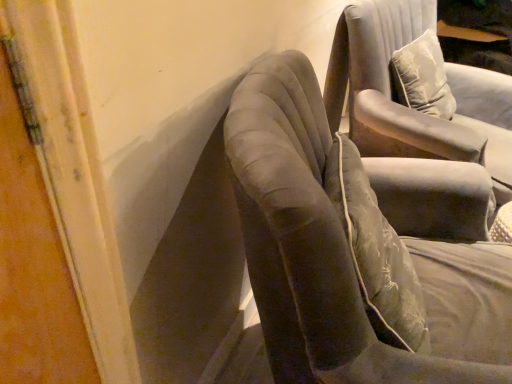
Question: Is velvet gray chair at center, which is counted as the second chair, starting from the back, surrounding suede-like gray chair at upper right, which is counted as the 2th chair, starting from the front?

Choices:
 (A) no
 (B) yes

Answer: (A)

Question: From a real-world perspective, is velvet gray chair at center, positioned as the first chair in front-to-back order, physically above suede-like gray chair at upper right, which is counted as the 2th chair, starting from the front?

Choices:
 (A) yes
 (B) no

Answer: (B)

Question: Are velvet gray chair at center, which is counted as the second chair, starting from the back, and suede-like gray chair at upper right, placed as the first chair when sorted from back to front, far apart?

Choices:
 (A) no
 (B) yes

Answer: (A)

Question: Is velvet gray chair at center, positioned as the first chair in front-to-back order, not within suede-like gray chair at upper right, placed as the first chair when sorted from back to front?

Choices:
 (A) yes
 (B) no

Answer: (A)

Question: Does velvet gray chair at center, which is counted as the second chair, starting from the back, lie behind suede-like gray chair at upper right, placed as the first chair when sorted from back to front?

Choices:
 (A) no
 (B) yes

Answer: (A)

Question: Considering the relative sizes of velvet gray chair at center, which is counted as the second chair, starting from the back, and suede-like gray chair at upper right, which is counted as the 2th chair, starting from the front, in the image provided, is velvet gray chair at center, which is counted as the second chair, starting from the back, wider than suede-like gray chair at upper right, which is counted as the 2th chair, starting from the front,?

Choices:
 (A) no
 (B) yes

Answer: (B)

Question: Is velvet gray chair at center, which is counted as the second chair, starting from the back, a part of suede-like gray chair at upper right, which is counted as the 2th chair, starting from the front?

Choices:
 (A) yes
 (B) no

Answer: (B)

Question: Is the position of suede-like gray chair at upper right, placed as the first chair when sorted from back to front, more distant than that of velvet gray chair at center, positioned as the first chair in front-to-back order?

Choices:
 (A) no
 (B) yes

Answer: (B)

Question: Considering the relative sizes of suede-like gray chair at upper right, which is counted as the 2th chair, starting from the front, and velvet gray chair at center, positioned as the first chair in front-to-back order, in the image provided, is suede-like gray chair at upper right, which is counted as the 2th chair, starting from the front, wider than velvet gray chair at center, positioned as the first chair in front-to-back order,?

Choices:
 (A) yes
 (B) no

Answer: (B)

Question: Considering the relative sizes of suede-like gray chair at upper right, placed as the first chair when sorted from back to front, and velvet gray chair at center, which is counted as the second chair, starting from the back, in the image provided, is suede-like gray chair at upper right, placed as the first chair when sorted from back to front, thinner than velvet gray chair at center, which is counted as the second chair, starting from the back,?

Choices:
 (A) yes
 (B) no

Answer: (A)

Question: Are suede-like gray chair at upper right, which is counted as the 2th chair, starting from the front, and velvet gray chair at center, positioned as the first chair in front-to-back order, located far from each other?

Choices:
 (A) yes
 (B) no

Answer: (B)

Question: Can you confirm if suede-like gray chair at upper right, which is counted as the 2th chair, starting from the front, is bigger than velvet gray chair at center, positioned as the first chair in front-to-back order?

Choices:
 (A) yes
 (B) no

Answer: (B)

Question: From a real-world perspective, is velvet gray chair at center, positioned as the first chair in front-to-back order, physically located above or below suede-like gray chair at upper right, which is counted as the 2th chair, starting from the front?

Choices:
 (A) below
 (B) above

Answer: (A)